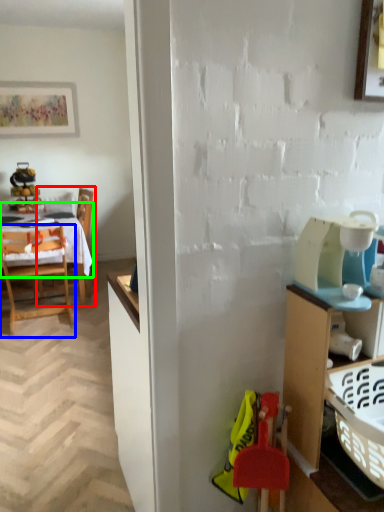
Question: Which object is the farthest from chair (highlighted by a red box)? Choose among these: chair (highlighted by a blue box) or tablecloth (highlighted by a green box).

Choices:
 (A) chair
 (B) tablecloth

Answer: (A)